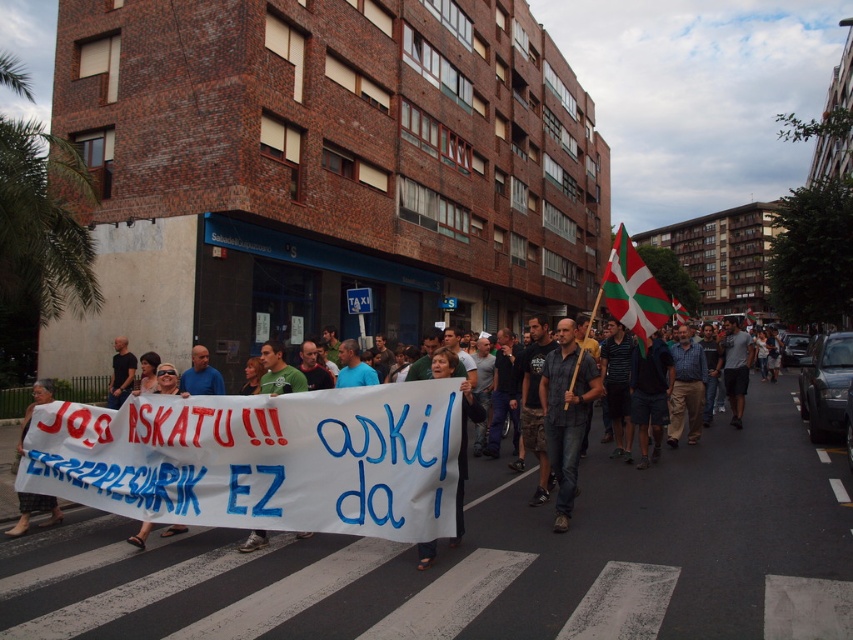
Does denim jeans at center have a smaller size compared to white fabric banner at lower left?

Indeed, denim jeans at center has a smaller size compared to white fabric banner at lower left.

Looking at this image, does denim jeans at center appear on the right side of white fabric banner at lower left?

Indeed, denim jeans at center is positioned on the right side of white fabric banner at lower left.

Is point (575, 422) behind point (22, 436)?

No, (575, 422) is in front of (22, 436).

At what (x,y) coordinates should I click in order to perform the action: click on denim jeans at center. Please return your answer as a coordinate pair (x, y). The width and height of the screenshot is (853, 640). Looking at the image, I should click on (566, 413).

Is denim jeans at center to the right of white fabric flag at center from the viewer's perspective?

In fact, denim jeans at center is to the left of white fabric flag at center.

Describe the element at coordinates (566, 413) in the screenshot. The image size is (853, 640). I see `denim jeans at center` at that location.

Describe the element at coordinates (566, 413) in the screenshot. The width and height of the screenshot is (853, 640). I see `denim jeans at center` at that location.

Find the location of a particular element. Image resolution: width=853 pixels, height=640 pixels. denim jeans at center is located at coordinates (566, 413).

Where is `red and white striped flag at center`? The image size is (853, 640). red and white striped flag at center is located at coordinates (679, 310).

Between red and white striped flag at center and white fabric flag at center, which one has less height?

red and white striped flag at center is shorter.

Between point (677, 307) and point (751, 324), which one is positioned in front?

Point (677, 307) is in front.

At what (x,y) coordinates should I click in order to perform the action: click on red and white striped flag at center. Please return your answer as a coordinate pair (x, y). Image resolution: width=853 pixels, height=640 pixels. Looking at the image, I should click on (679, 310).